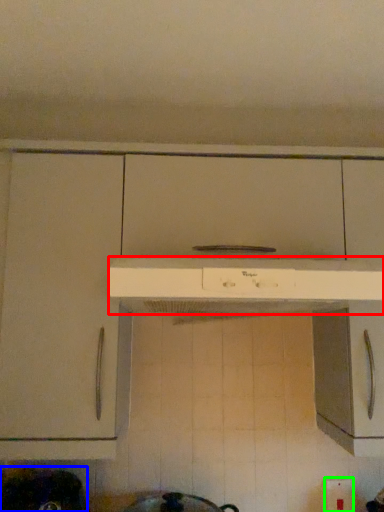
Question: Considering the real-world distances, which object is closest to home appliance (highlighted by a red box)? appliance (highlighted by a blue box) or electric outlet (highlighted by a green box).

Choices:
 (A) appliance
 (B) electric outlet

Answer: (A)